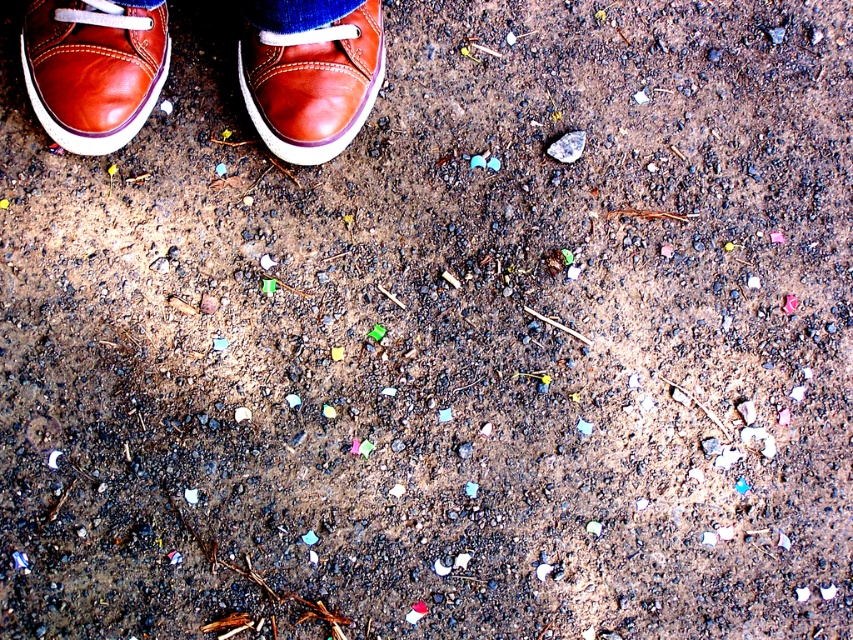
You are a delivery robot trying to place a small package between the brown leather shoe at upper center and the blue denim jeans at upper center. Can you fit the package there?

The brown leather shoe at upper center is thinner than the blue denim jeans at upper center, so there might be enough space between them to fit the package, but it depends on the exact dimensions of the package and the gap between the two items.

You are a photographer trying to capture the brown leather shoes at upper left and the matte brown shoe at center. Since both are in the same frame, can you determine which one is closer to the camera based on their positions?

The brown leather shoes at upper left is positioned over matte brown shoe at center, meaning it is closer to the camera.

You are standing on the ground and see the brown leather shoes at upper left and the matte brown shoe at center. Which one is closer to you?

The brown leather shoes at upper left is closer to you because it is further to the viewer than the matte brown shoe at center.